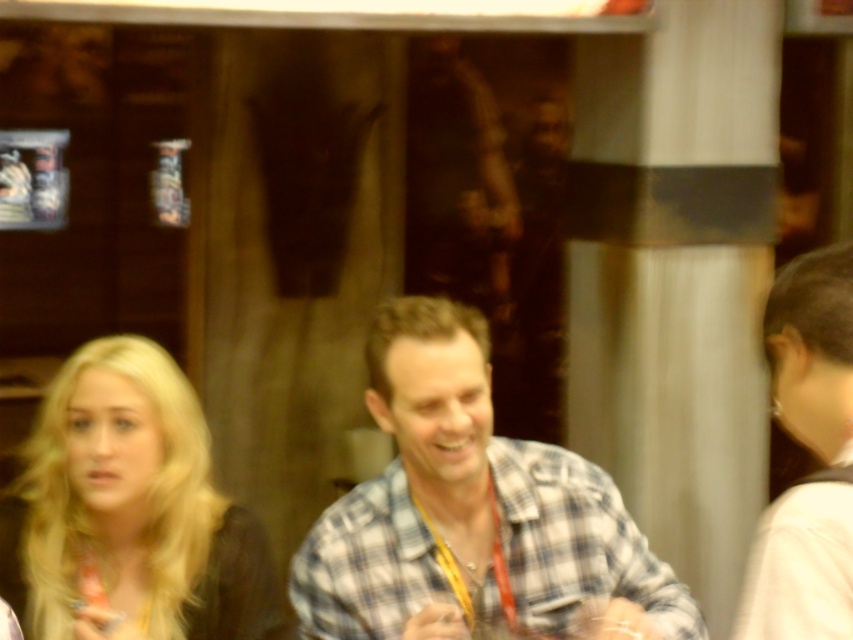
Can you confirm if plaid fabric shirt at center is shorter than blonde hair at center?

No.

This screenshot has height=640, width=853. What do you see at coordinates (473, 513) in the screenshot?
I see `plaid fabric shirt at center` at bounding box center [473, 513].

Does point (428, 522) come farther from viewer compared to point (209, 483)?

No, (428, 522) is in front of (209, 483).

This screenshot has width=853, height=640. What are the coordinates of `plaid fabric shirt at center` in the screenshot? It's located at (473, 513).

Does blonde hair at center have a smaller size compared to white fabric hair at right?

No.

Consider the image. Does blonde hair at center appear on the right side of white fabric hair at right?

No, blonde hair at center is not to the right of white fabric hair at right.

Is point (195, 512) closer to camera compared to point (825, 614)?

That is False.

This screenshot has height=640, width=853. What are the coordinates of `blonde hair at center` in the screenshot? It's located at (132, 509).

Can you confirm if plaid fabric shirt at center is smaller than white fabric hair at right?

No, plaid fabric shirt at center is not smaller than white fabric hair at right.

In the scene shown: Who is higher up, plaid fabric shirt at center or white fabric hair at right?

white fabric hair at right

Does point (466, 486) come in front of point (830, 433)?

No.

Identify the location of plaid fabric shirt at center. Image resolution: width=853 pixels, height=640 pixels. point(473,513).